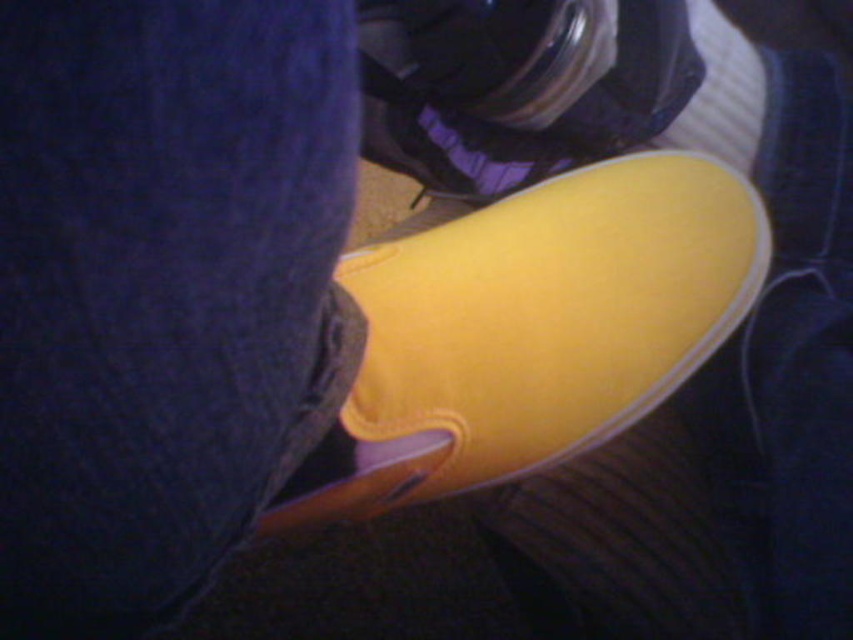
You are a photographer trying to capture the yellow canvas shoe at center and the yellow fabric shoe at center. Since both shoes are yellow, how can you distinguish which one is closer to the camera?

The yellow canvas shoe at center is positioned under the yellow fabric shoe at center, so the fabric shoe is closer to the camera because it is above the canvas shoe.

You are standing in front of the image and want to know which of the two points, point (509, 333) or point (401, 60), is closer to you. Based on the scene description, can you determine which point is nearer?

Point (509, 333) is in front of point (401, 60), so it is closer to you.

You are standing in front of a camera with a purple strap at the top center of the frame. You want to take a photo of the yellow canvas shoe at center. Where should you position the camera relative to the shoe to ensure it is centered in your shot?

To center the yellow canvas shoe at center in your shot, position the camera so that the shoe is aligned with the center point of the frame, which corresponds to the coordinates provided in the description.